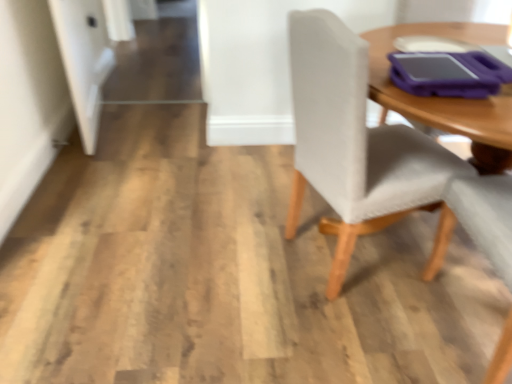
This screenshot has height=384, width=512. I want to click on free point in front of light gray fabric chair at right, so click(x=350, y=337).